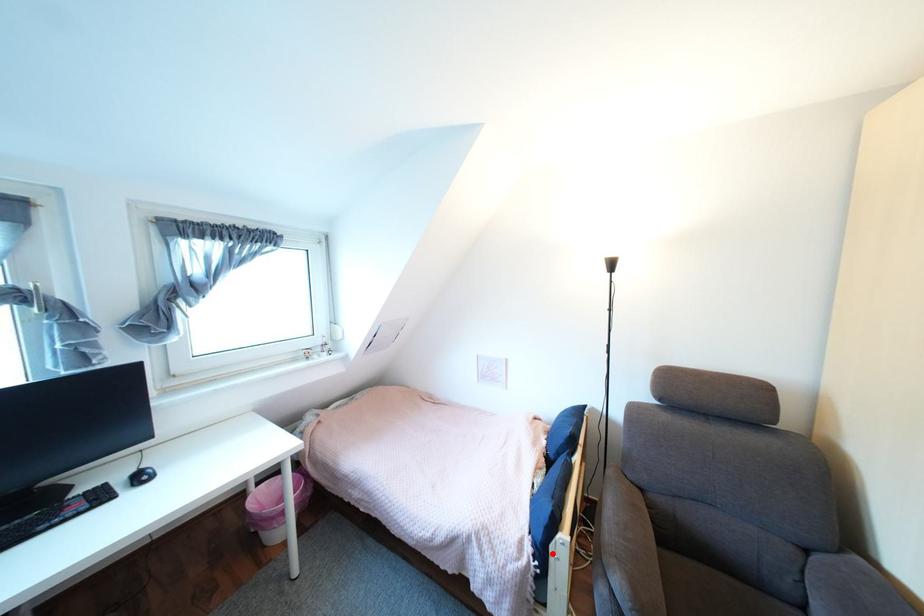
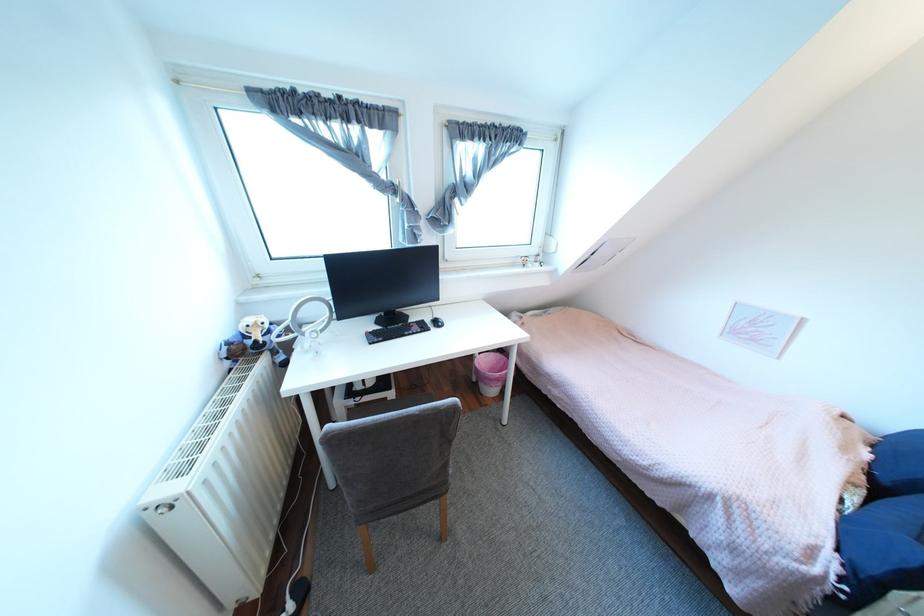
Locate, in the second image, the point that corresponds to the highlighted location in the first image.

(873, 586)